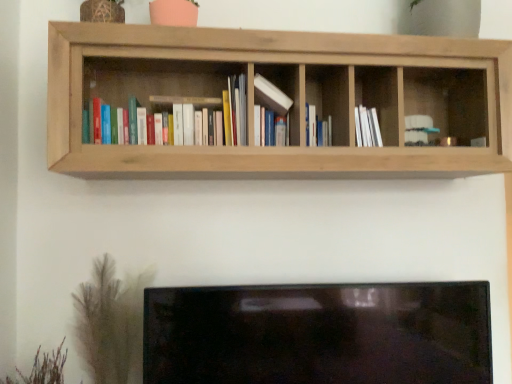
Question: Is the position of matte hardcover books at left, marked as the 1th book in a left-to-right arrangement, more distant than that of white paper at center?

Choices:
 (A) no
 (B) yes

Answer: (A)

Question: Is matte hardcover books at left, placed as the 3th book when sorted from right to left, to the right of white paper at center from the viewer's perspective?

Choices:
 (A) no
 (B) yes

Answer: (A)

Question: Is the position of matte hardcover books at left, placed as the 3th book when sorted from right to left, less distant than that of white paper at center?

Choices:
 (A) no
 (B) yes

Answer: (B)

Question: Does matte hardcover books at left, placed as the 3th book when sorted from right to left, turn towards white paper at center?

Choices:
 (A) no
 (B) yes

Answer: (A)

Question: From a real-world perspective, does matte hardcover books at left, placed as the 3th book when sorted from right to left, stand above white paper at center?

Choices:
 (A) no
 (B) yes

Answer: (B)

Question: Can you confirm if matte hardcover books at left, marked as the 1th book in a left-to-right arrangement, is shorter than white paper at center?

Choices:
 (A) yes
 (B) no

Answer: (B)

Question: Is natural wood shelf at upper center at the back of brown textured plant at lower left, the first plant from the right?

Choices:
 (A) yes
 (B) no

Answer: (B)

Question: Can you confirm if brown textured plant at lower left, which is the second plant from left to right, is bigger than natural wood shelf at upper center?

Choices:
 (A) yes
 (B) no

Answer: (B)

Question: Does brown textured plant at lower left, the first plant from the right, touch natural wood shelf at upper center?

Choices:
 (A) no
 (B) yes

Answer: (A)

Question: Does brown textured plant at lower left, which is the second plant from left to right, appear on the left side of natural wood shelf at upper center?

Choices:
 (A) yes
 (B) no

Answer: (A)

Question: Considering the relative sizes of brown textured plant at lower left, the first plant from the right, and natural wood shelf at upper center in the image provided, is brown textured plant at lower left, the first plant from the right, shorter than natural wood shelf at upper center?

Choices:
 (A) no
 (B) yes

Answer: (B)

Question: Is brown textured plant at lower left, the first plant from the right, to the right of natural wood shelf at upper center from the viewer's perspective?

Choices:
 (A) yes
 (B) no

Answer: (B)

Question: Could natural wood shelf at upper center be considered to be inside white paper at center?

Choices:
 (A) yes
 (B) no

Answer: (B)